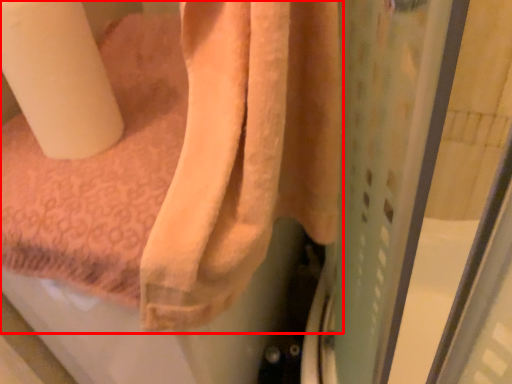
Question: From the image's perspective, what is the correct spatial positioning of towel (annotated by the red box) in reference to toilet paper?

Choices:
 (A) below
 (B) above

Answer: (A)